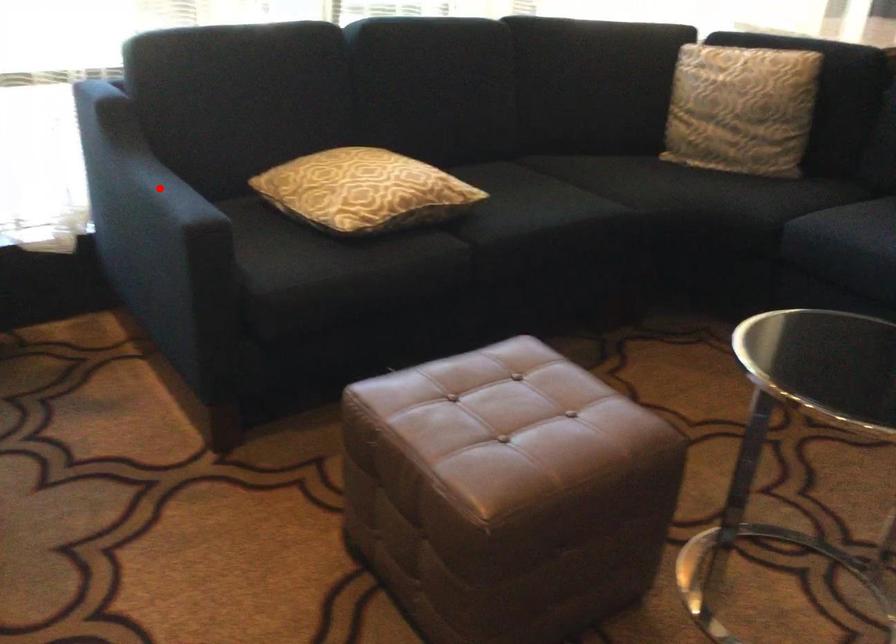
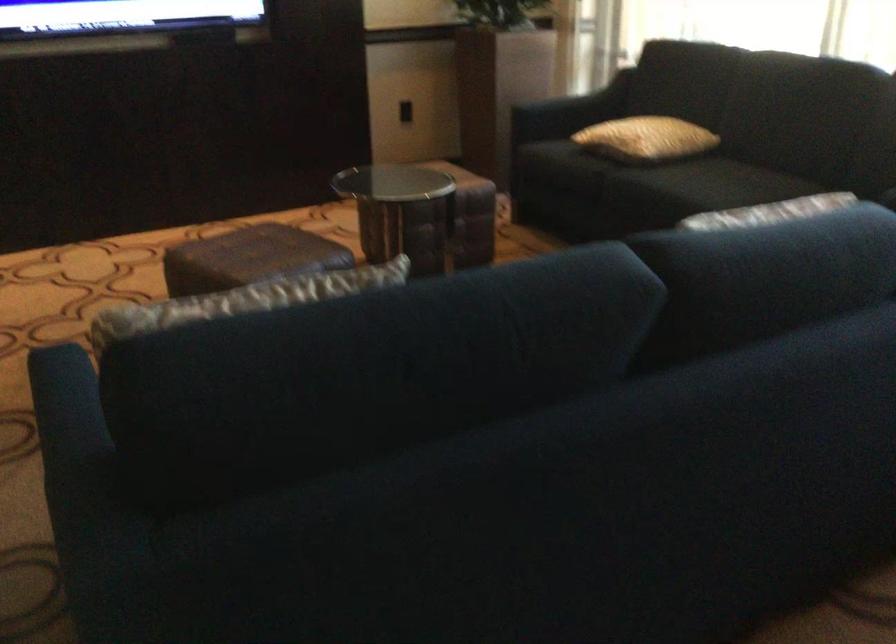
Where in the second image is the point corresponding to the highlighted location from the first image?

(586, 99)